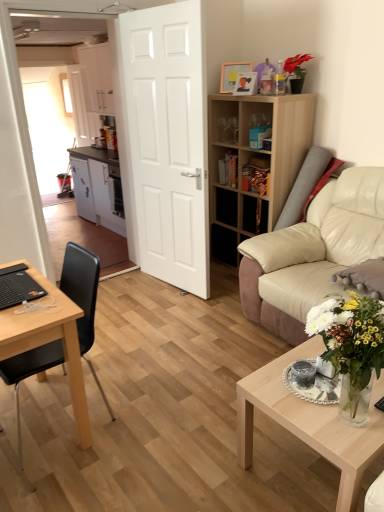
Locate an element on the screen. The image size is (384, 512). vacant space underneath light wood coffee table at lower right (from a real-world perspective) is located at coordinates (305, 471).